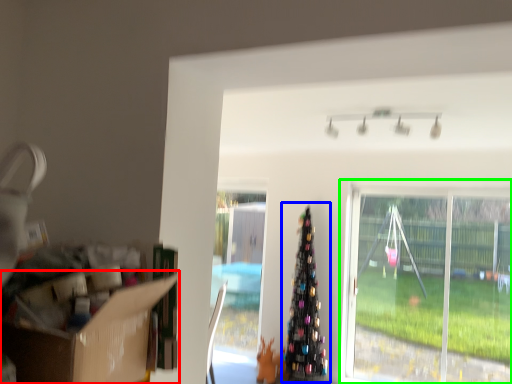
Question: Considering the real-world distances, which object is closest to cardboard box (highlighted by a red box)? christmas tree (highlighted by a blue box) or window (highlighted by a green box).

Choices:
 (A) christmas tree
 (B) window

Answer: (A)